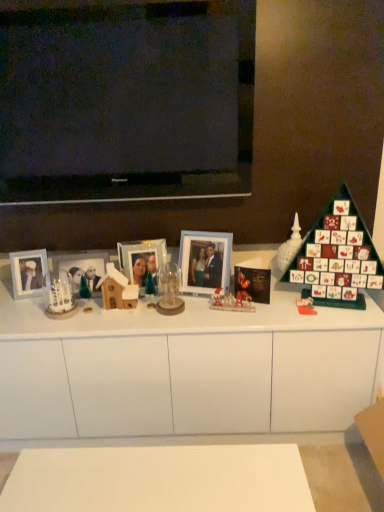
The width and height of the screenshot is (384, 512). In order to click on free space that is in between clear glass ornament at center, which is counted as the second toy, starting from the left, and translucent plastic figurines at center, placed as the third toy when sorted from right to left in this screenshot , I will do `click(207, 310)`.